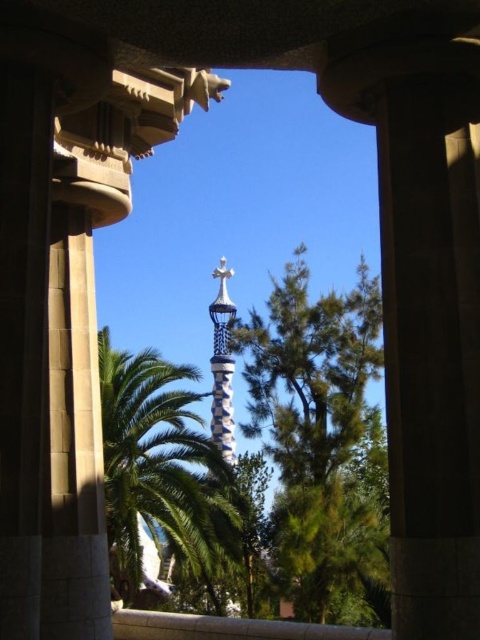
Question: Considering the relative positions of green leafy tree at center and green leafy palm tree at center in the image provided, where is green leafy tree at center located with respect to green leafy palm tree at center?

Choices:
 (A) left
 (B) right

Answer: (B)

Question: Can you confirm if green leafy tree at center is smaller than green leafy palm tree at center?

Choices:
 (A) no
 (B) yes

Answer: (B)

Question: Which of the following is the farthest from the observer?

Choices:
 (A) green leafy tree at center
 (B) green leafy palm tree at center
 (C) white mosaic spire at center

Answer: (C)

Question: Which is farther from the green leafy palm tree at center?

Choices:
 (A) green leafy tree at center
 (B) white mosaic spire at center

Answer: (B)

Question: Considering the relative positions of green leafy palm tree at center and white mosaic spire at center in the image provided, where is green leafy palm tree at center located with respect to white mosaic spire at center?

Choices:
 (A) left
 (B) right

Answer: (A)

Question: Which object is farther from the camera taking this photo?

Choices:
 (A) white mosaic spire at center
 (B) green leafy tree at center
 (C) green leafy palm tree at center

Answer: (A)